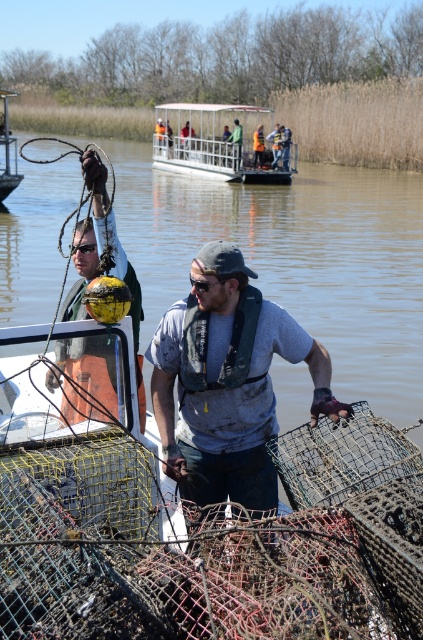
You are a boat operator who needs to secure both the yellow rubber buoy at left and the metallic yellow buoy at left to your vessel. Given their sizes, which buoy should you attach first to ensure stability?

The yellow rubber buoy at left has a greater width than the metallic yellow buoy at left, so you should attach the yellow rubber buoy at left first to ensure stability due to its larger size providing better balance.

You are standing on the dock and want to retrieve the metallic yellow buoy at left. If your longest reach is 2 meters, can you grab it without moving closer?

The metallic yellow buoy at left is 28.39 meters away from camera. Since your longest reach is only 2 meters, you cannot grab it without moving closer.

You are a safety inspector checking the placement of the metallic yellow buoy at left and the orange reflective vest at center. According to safety regulations, the buoy must be visible at all times and not obscured by any objects. Is the current placement compliant with the regulations?

The metallic yellow buoy at left is positioned under orange reflective vest at center, which means it is partially or fully obscured by the vest, violating the safety regulations requiring it to remain visible at all times.